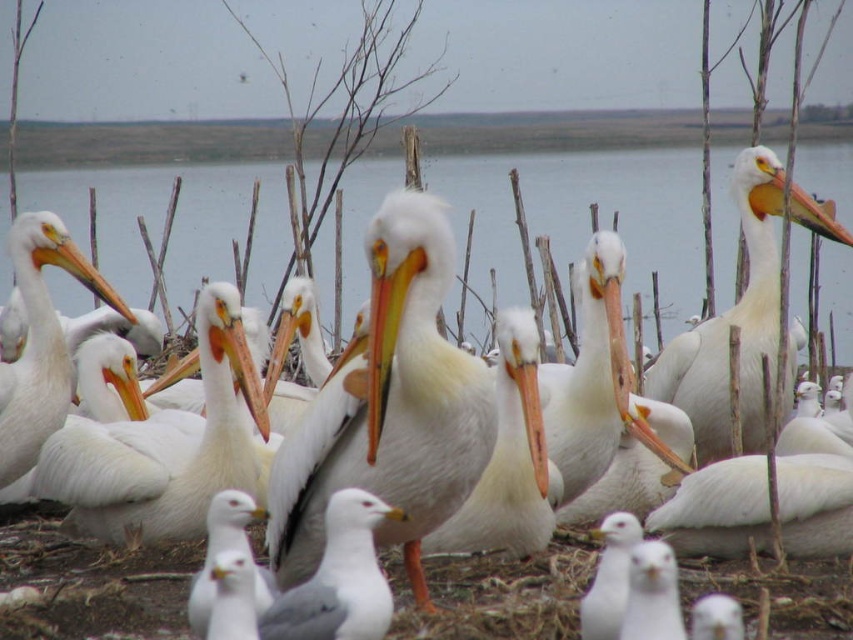
Question: Is white matte pelican at upper right wider than orange glossy beak at center?

Choices:
 (A) yes
 (B) no

Answer: (A)

Question: Is white matte pelican at upper right smaller than white matte seagull at center?

Choices:
 (A) yes
 (B) no

Answer: (B)

Question: Which object is closer to the camera taking this photo?

Choices:
 (A) white smooth pelican at center
 (B) white matte pelican at left
 (C) white matte pelican at center

Answer: (C)

Question: Which object is closer to the camera taking this photo?

Choices:
 (A) white smooth pelican at center
 (B) white matte pelican at center

Answer: (B)

Question: Is white smooth pelican at center closer to the viewer compared to white matte bird at center?

Choices:
 (A) no
 (B) yes

Answer: (A)

Question: Which object appears closest to the camera in this image?

Choices:
 (A) white smooth pelican at center
 (B) orange glossy beak at center
 (C) white matte seagull at center

Answer: (C)